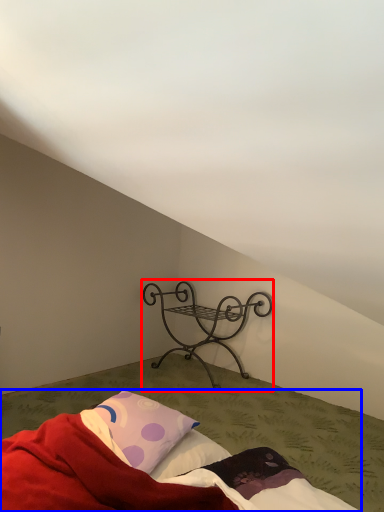
Question: Among these objects, which one is nearest to the camera, furniture (highlighted by a red box) or bed (highlighted by a blue box)?

Choices:
 (A) furniture
 (B) bed

Answer: (B)